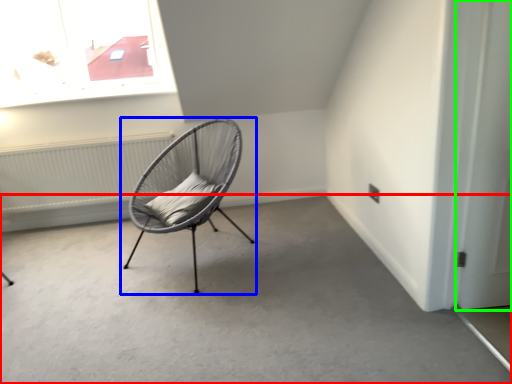
Question: Which object is positioned closest to concrete (highlighted by a red box)? Select from chair (highlighted by a blue box) and door (highlighted by a green box).

Choices:
 (A) chair
 (B) door

Answer: (A)